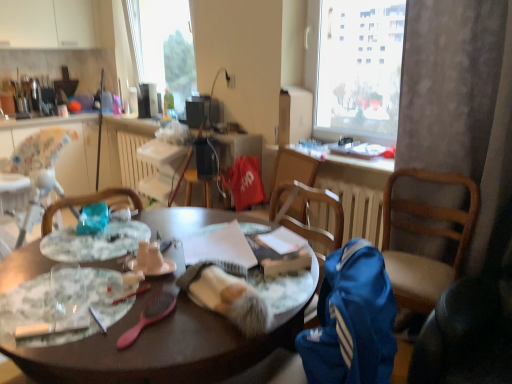
Question: Does white glossy countertop at upper left have a lesser width compared to wooden table at center?

Choices:
 (A) no
 (B) yes

Answer: (B)

Question: From a real-world perspective, is white glossy countertop at upper left over wooden table at center?

Choices:
 (A) yes
 (B) no

Answer: (A)

Question: Can you confirm if white glossy countertop at upper left is positioned to the left of wooden table at center?

Choices:
 (A) no
 (B) yes

Answer: (B)

Question: Does white glossy countertop at upper left have a greater height compared to wooden table at center?

Choices:
 (A) no
 (B) yes

Answer: (A)

Question: Is white glossy countertop at upper left far from wooden table at center?

Choices:
 (A) no
 (B) yes

Answer: (B)

Question: Does point (444, 89) appear closer or farther from the camera than point (154, 266)?

Choices:
 (A) closer
 (B) farther

Answer: (B)

Question: Considering the positions of white textured curtain at right and matte white coffee cup at center in the image, is white textured curtain at right wider or thinner than matte white coffee cup at center?

Choices:
 (A) thin
 (B) wide

Answer: (B)

Question: Which is correct: white textured curtain at right is inside matte white coffee cup at center, or outside of it?

Choices:
 (A) outside
 (B) inside

Answer: (A)

Question: Considering their positions, is white textured curtain at right located in front of or behind matte white coffee cup at center?

Choices:
 (A) behind
 (B) front

Answer: (A)

Question: Considering the positions of matte plastic power outlet at upper center and blue fabric chair at right in the image, is matte plastic power outlet at upper center taller or shorter than blue fabric chair at right?

Choices:
 (A) tall
 (B) short

Answer: (B)

Question: Is matte plastic power outlet at upper center situated inside blue fabric chair at right or outside?

Choices:
 (A) inside
 (B) outside

Answer: (B)

Question: From a real-world perspective, relative to blue fabric chair at right, is matte plastic power outlet at upper center vertically above or below?

Choices:
 (A) above
 (B) below

Answer: (A)

Question: Visually, is matte plastic power outlet at upper center positioned to the left or to the right of blue fabric chair at right?

Choices:
 (A) right
 (B) left

Answer: (B)

Question: From a real-world perspective, is matte white coffee cup at center physically located above or below matte plastic power outlet at upper center?

Choices:
 (A) above
 (B) below

Answer: (B)

Question: Is matte white coffee cup at center bigger or smaller than matte plastic power outlet at upper center?

Choices:
 (A) small
 (B) big

Answer: (A)